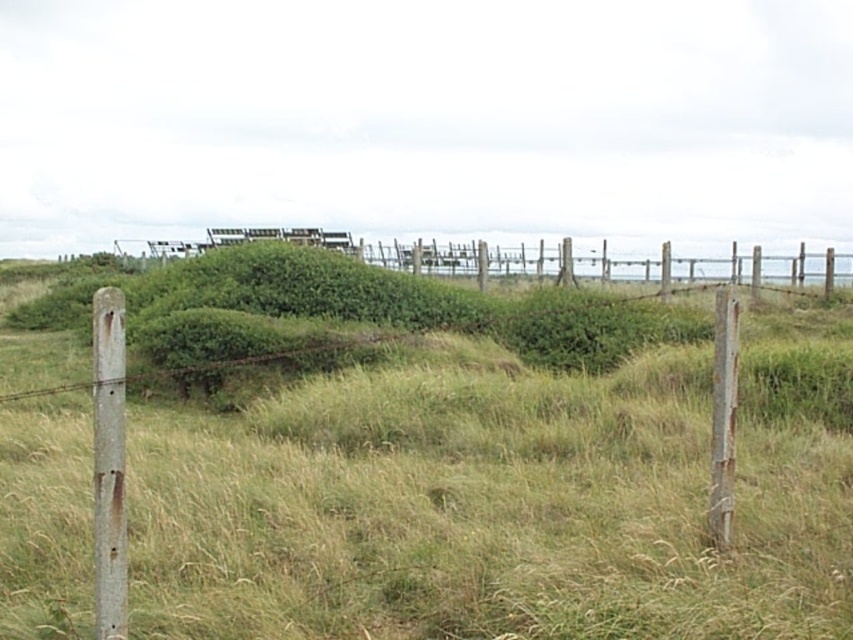
You are standing at the point marked by point (474, 470) in the image. What is the immediate terrain you are standing on?

The point (474, 470) marks green grassy at center, so you are standing on green grassy terrain.